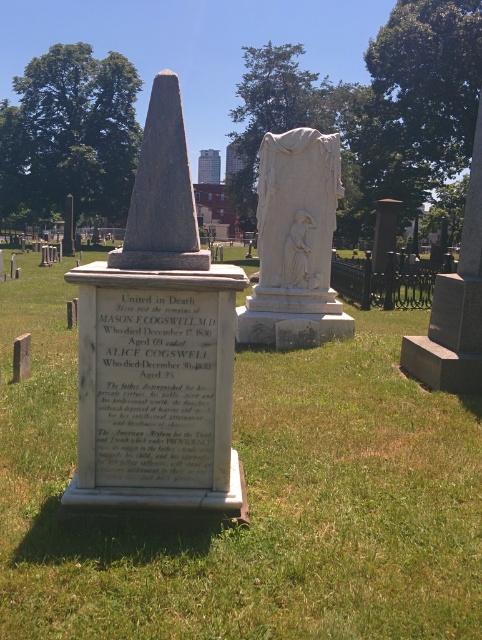
Question: Is green grass at center smaller than smooth gray stone monument at center?

Choices:
 (A) yes
 (B) no

Answer: (B)

Question: Can you confirm if white marble statue at center is positioned to the left of smooth gray stone monument at center?

Choices:
 (A) yes
 (B) no

Answer: (A)

Question: Which of the following is the closest to the observer?

Choices:
 (A) white marble obelisk at center
 (B) white marble statue at center
 (C) granite obelisk at center
 (D) smooth gray stone monument at center

Answer: (A)

Question: Does green grass at center appear over white marble obelisk at center?

Choices:
 (A) no
 (B) yes

Answer: (B)

Question: Which is farther from the granite obelisk at center?

Choices:
 (A) white marble obelisk at center
 (B) white marble statue at center

Answer: (B)

Question: Which point is closer to the camera?

Choices:
 (A) (476, 186)
 (B) (156, 252)
 (C) (253, 333)
 (D) (442, 586)

Answer: (D)